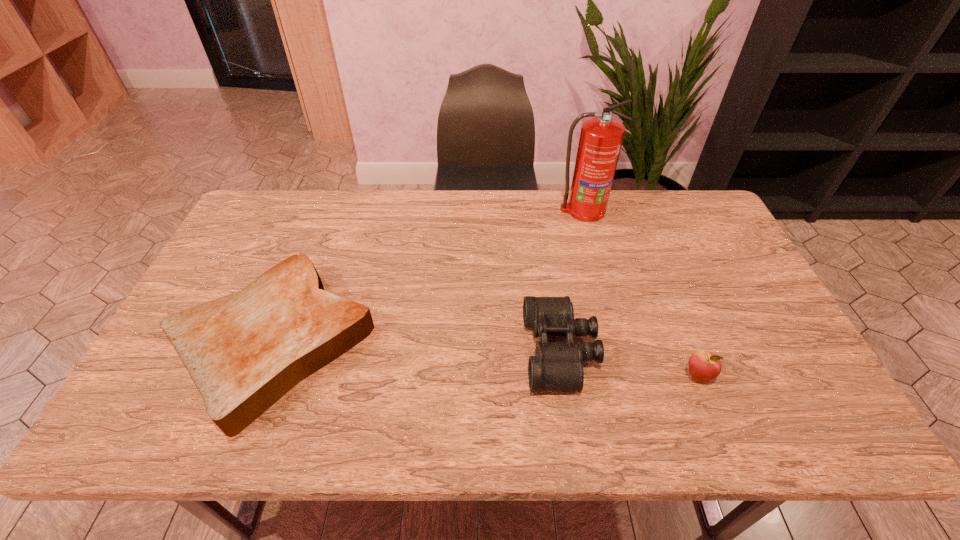
Locate an element on the screen. The image size is (960, 540). vacant area at the far left corner of the desktop is located at coordinates (268, 221).

Find the location of `free area in between the fire extinguisher and the binoculars`. free area in between the fire extinguisher and the binoculars is located at coordinates (572, 280).

Locate an element on the screen. This screenshot has height=540, width=960. vacant point located between the rightmost object and the shortest object is located at coordinates (486, 360).

I want to click on vacant space in between the rightmost object and the farthest object, so click(x=640, y=293).

Identify the location of free space between the shortest object and the binoculars. The width and height of the screenshot is (960, 540). (417, 347).

Find the location of a particular element. free space that is in between the tallest object and the binoculars is located at coordinates (572, 280).

This screenshot has height=540, width=960. Identify the location of free spot between the bread and the tallest object. (428, 276).

The image size is (960, 540). Find the location of `free space between the rightmost object and the leftmost object`. free space between the rightmost object and the leftmost object is located at coordinates (486, 360).

Where is `free area in between the tallest object and the shortest object`? Image resolution: width=960 pixels, height=540 pixels. free area in between the tallest object and the shortest object is located at coordinates (428, 276).

I want to click on unoccupied area between the bread and the binoculars, so click(x=417, y=347).